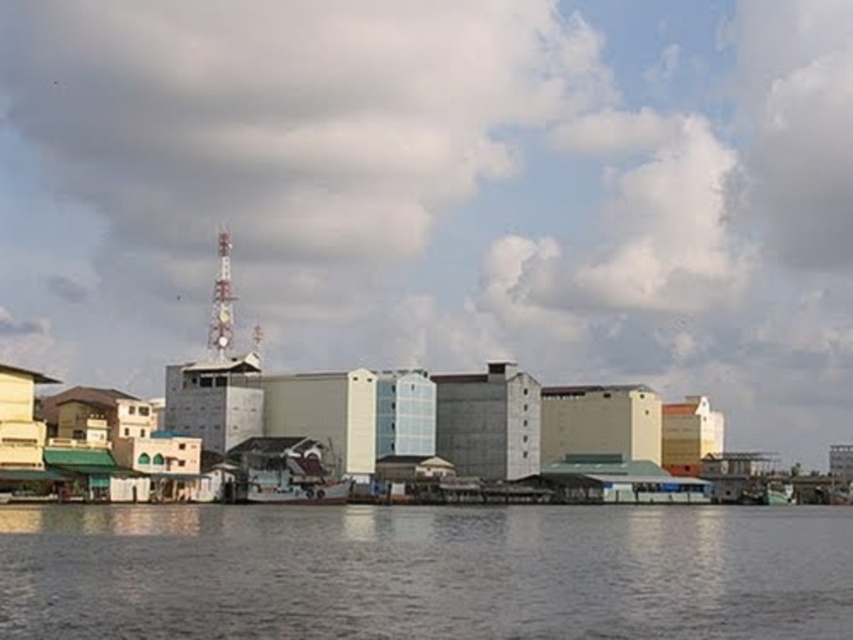
You are a drone operator planning to capture aerial footage of the waterfront scene. The drone must stay above the transparent water at lower center to ensure clear reflections. According to the coordinates provided, what is the exact 2D location you should program the drone to hover at?

The exact 2D location to program the drone to hover at is point (425, 572) above the transparent water at lower center.

What object is located at the point with coordinates [442,192] in the scene?

The point at coordinates [442,192] indicates a white fluffy cloud at upper center.

Consider the image. You are a photographer planning to capture the reflection of the communication tower in the transparent water at lower center. However, there is a white matte boat at center in the scene. Will the boat obstruct the reflection of the communication tower in the water?

The transparent water at lower center is above the white matte boat at center, so the boat is submerged or floating below the water surface. This means the boat would not obstruct the reflection of the communication tower in the water.